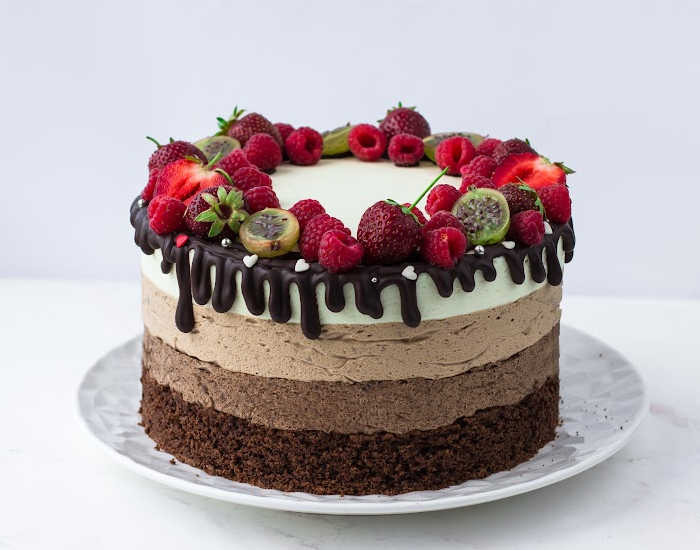
Find the location of a particular element. The image size is (700, 550). glass is located at coordinates (101, 422).